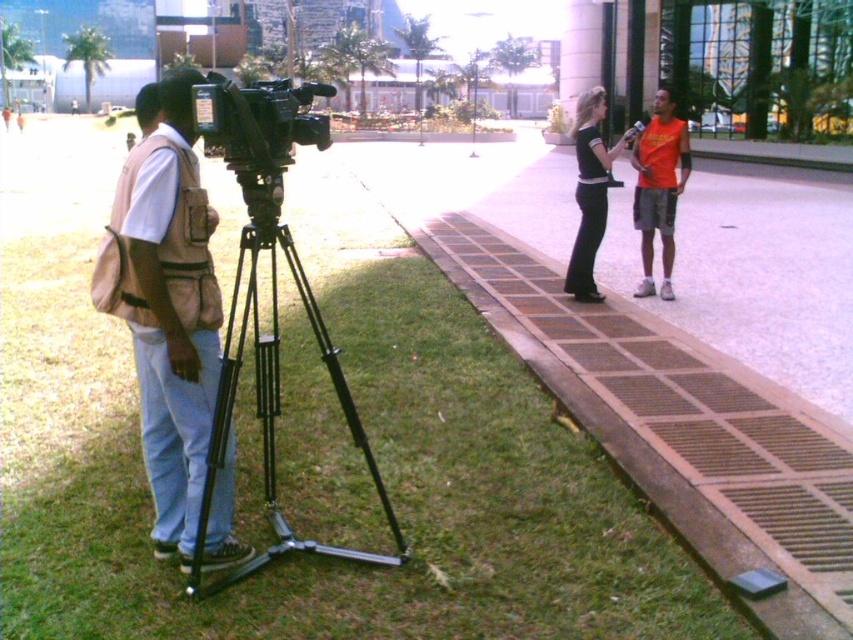
Question: Is black metallic tripod at left further to camera compared to black matte video camera at center?

Choices:
 (A) no
 (B) yes

Answer: (B)

Question: Which point is closer to the camera?

Choices:
 (A) (293, 541)
 (B) (125, 420)

Answer: (A)

Question: Does brown textured pavement at lower right have a greater width compared to black metallic tripod at left?

Choices:
 (A) yes
 (B) no

Answer: (A)

Question: Is brown textured pavement at lower right to the right of black metallic tripod at left from the viewer's perspective?

Choices:
 (A) no
 (B) yes

Answer: (B)

Question: Which point is farther to the camera?

Choices:
 (A) (668, 154)
 (B) (178, 214)

Answer: (A)

Question: Among these objects, which one is farthest from the camera?

Choices:
 (A) black matte video camera at center
 (B) black smooth pants at center
 (C) green grass at lower left

Answer: (B)